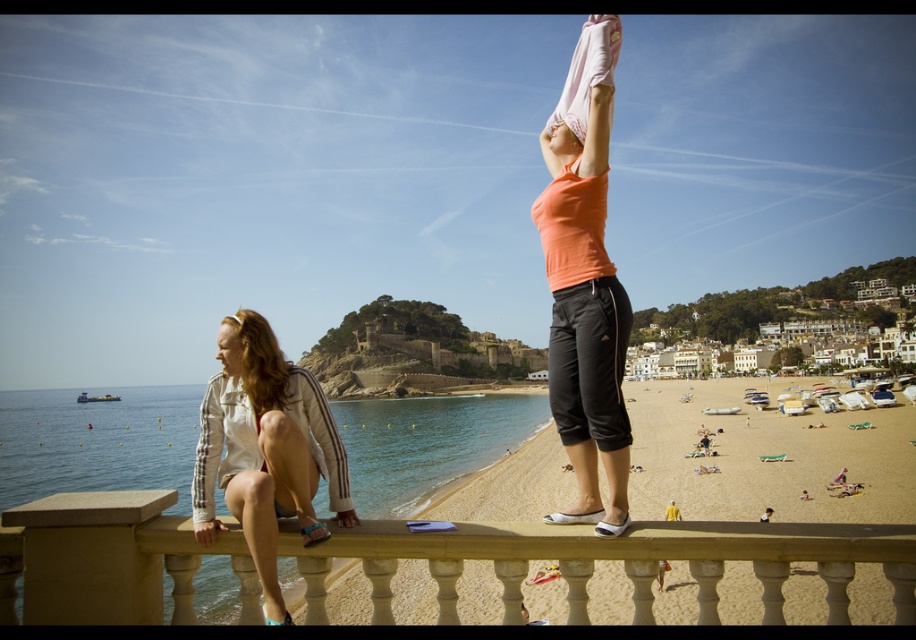
You are a photographer trying to capture both the beige stone balustrade at center and the matte orange tank top at center in a single frame. Given their sizes, which object will appear larger in your photo?

The beige stone balustrade at center will appear larger in the photo because it is bigger than the matte orange tank top at center according to the description.

You are a photographer trying to capture the perfect shot of the beach scene. You notice a point at coordinates (585,342). What object is located at this point?

The point at coordinates (585,342) corresponds to the matte orange tank top at center.

You are a photographer trying to capture the two women on the beach. You notice the matte orange tank top at center and the pink fabric head at upper center. Which one should you focus on if you want to highlight the larger object in your shot?

The matte orange tank top at center is larger in size than the pink fabric head at upper center, so you should focus on the matte orange tank top at center to highlight the larger object.